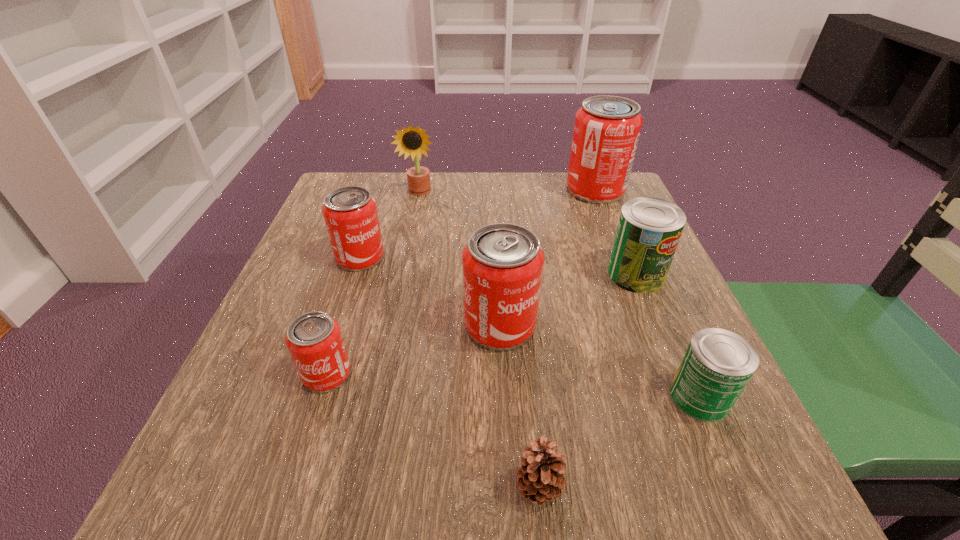
This screenshot has height=540, width=960. Identify the location of the biggest red can. (606, 132).

I want to click on the farthest red can, so coord(606,132).

Where is `sunflower`? The image size is (960, 540). sunflower is located at coordinates (413, 141).

Where is `the third red can from left to right`? The height and width of the screenshot is (540, 960). the third red can from left to right is located at coordinates (502, 263).

Find the location of `the fifth shortest can`. the fifth shortest can is located at coordinates (502, 263).

This screenshot has height=540, width=960. What are the coordinates of `the third biggest red can` in the screenshot? It's located at (350, 213).

Where is `the farther green can`? the farther green can is located at coordinates (649, 229).

Locate an element on the screen. Image resolution: width=960 pixels, height=540 pixels. the nearest red can is located at coordinates (314, 340).

Locate an element on the screen. This screenshot has width=960, height=540. the nearer green can is located at coordinates (717, 365).

Where is `the nearest object`? The height and width of the screenshot is (540, 960). the nearest object is located at coordinates (541, 478).